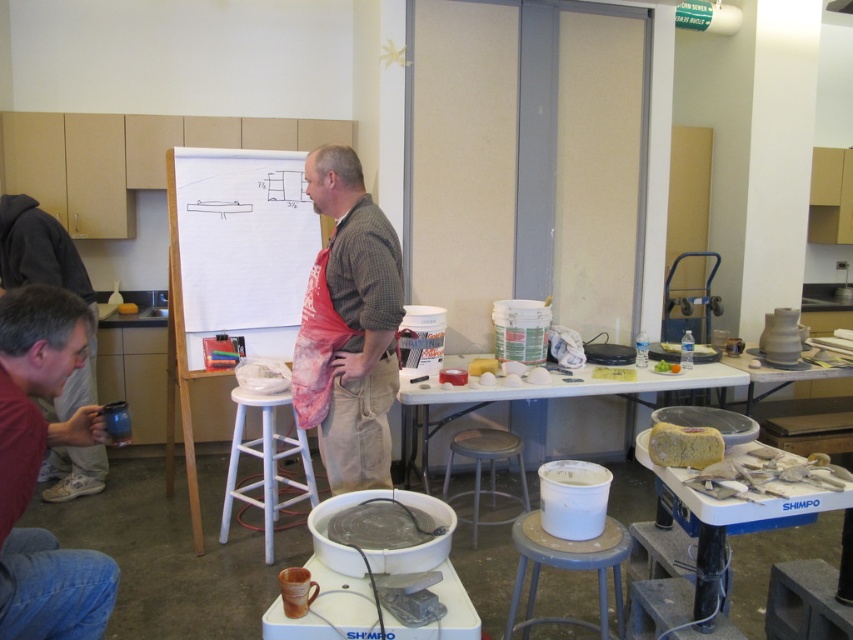
You are an art student who just entered the studio and see the red apron at center and the white glossy table at center. Which object is closer to you?

The red apron at center is closer to you since it is in front of the white glossy table at center.